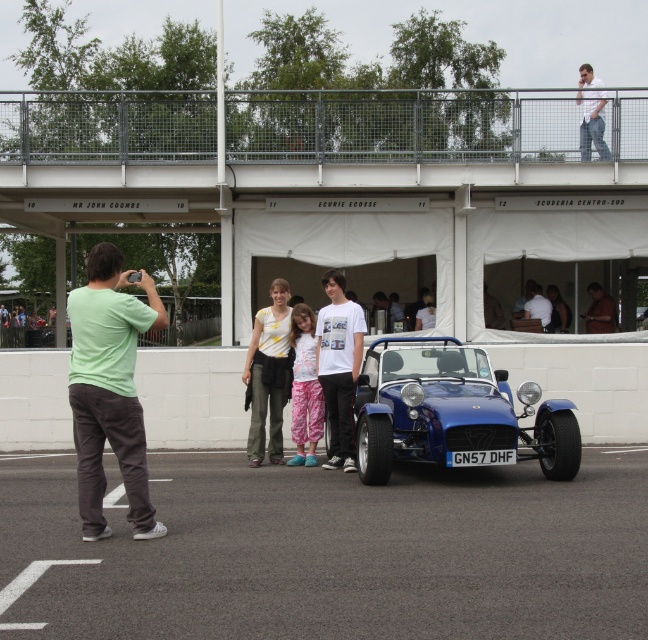
You are standing at the point marked as point (x=526, y=403) in the image. You want to take a photo of the bright blue open top sports car with license plate GN57 DHF. Is there enough space between you and the car to move freely?

The distance of point (x=526, y=403) from viewer is 11.59 meters, so there is sufficient space between you and the car to move freely.

You are a photographer at the event and want to ensure both the green cotton shirt at left and the white cotton shirt at center are clearly visible in your photo. Based on their positions, which shirt should you focus on first to ensure both are in focus?

The green cotton shirt at left is in front of the white cotton shirt at center. To ensure both are in focus, you should focus on the green cotton shirt at left first since it is closer to the camera, allowing the white cotton shirt at center to fall within the depth of field.

You are a photographer at the motorsport event. You need to capture a photo of the shiny blue car at center and the yellow printed shirt at center. If the camera can only focus on objects wider than 1 meter, will both objects be in focus?

The shiny blue car at center is wider than the yellow printed shirt at center. Since the car is wider than 1 meter, both objects will be in focus as they meet the camera requirement.